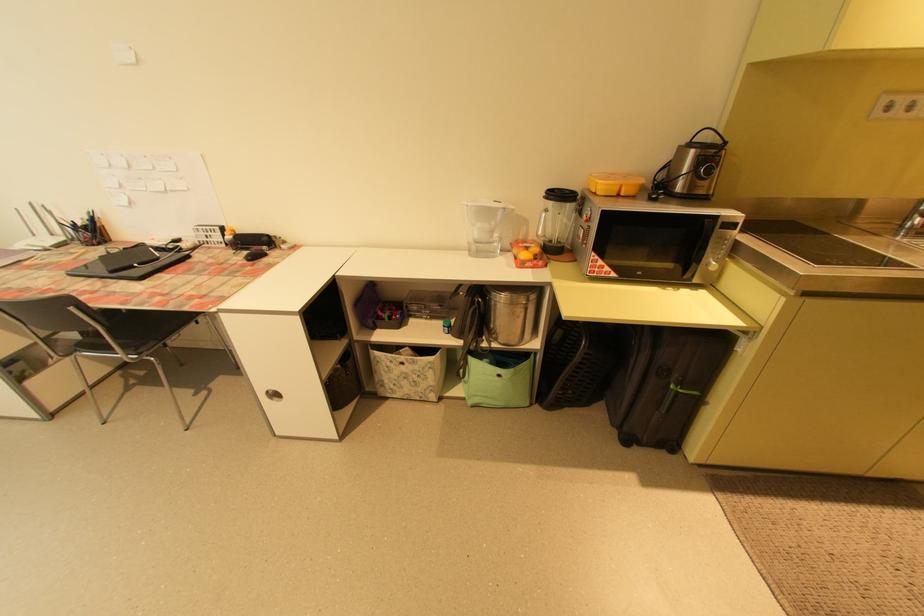
Describe the element at coordinates (136, 326) in the screenshot. I see `the black chair sitting surface` at that location.